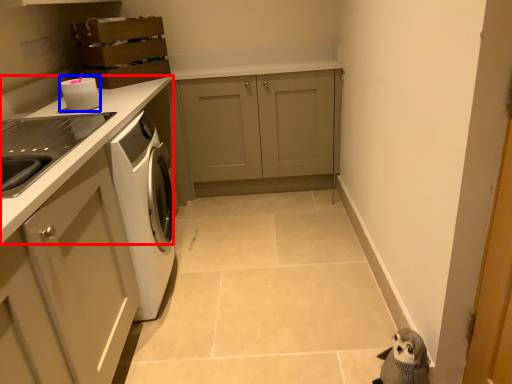
Question: Which object appears closest to the camera in this image, countertop (highlighted by a red box) or appliance (highlighted by a blue box)?

Choices:
 (A) countertop
 (B) appliance

Answer: (A)